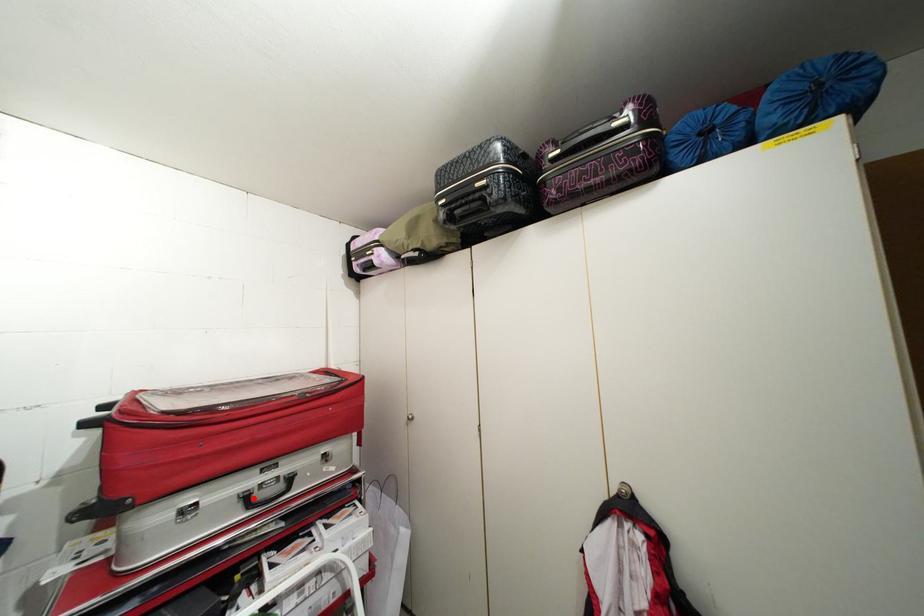
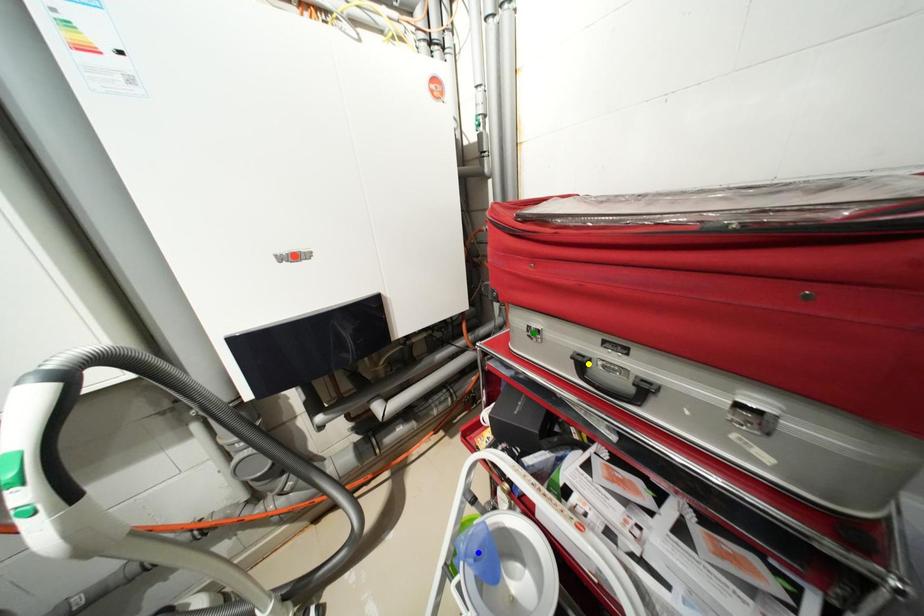
Question: I am providing you with two images of the same scene from different viewpoints. A red point is marked on the first image. You are given multiple points on the second image. Which spot in image 2 lines up with the point in image 1?

Choices:
 (A) green point
 (B) yellow point
 (C) blue point

Answer: (B)